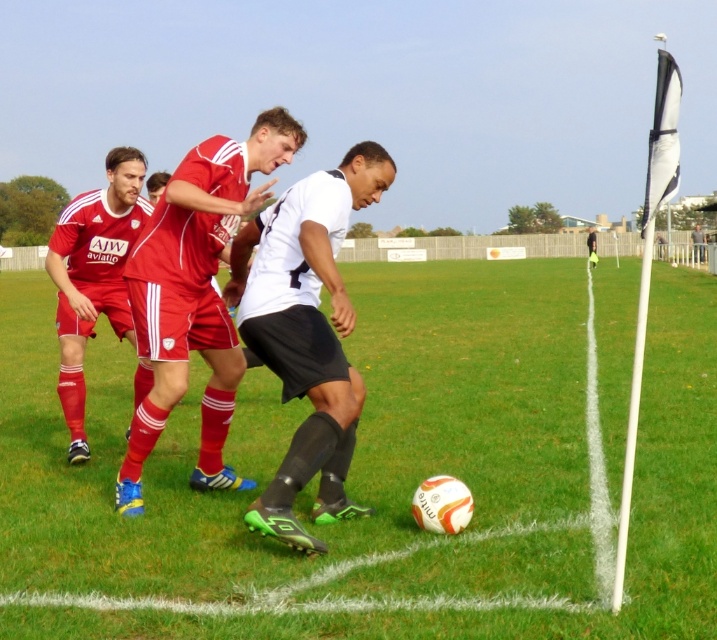
Is white matte soccer ball at center wider than matte red soccer jersey at left?

Correct, the width of white matte soccer ball at center exceeds that of matte red soccer jersey at left.

Where is `white matte soccer ball at center`? The width and height of the screenshot is (717, 640). white matte soccer ball at center is located at coordinates (294, 428).

Is point (551, 333) farther from viewer compared to point (110, 193)?

Yes.

At what (x,y) coordinates should I click in order to perform the action: click on white matte soccer ball at center. Please return your answer as a coordinate pair (x, y). Looking at the image, I should click on (294, 428).

Is the position of white matte soccer ball at center more distant than that of matte red shorts at center?

No, it is in front of matte red shorts at center.

From the picture: Is white matte soccer ball at center smaller than matte red shorts at center?

Incorrect, white matte soccer ball at center is not smaller in size than matte red shorts at center.

You are a GUI agent. You are given a task and a screenshot of the screen. Output one action in this format:
    pyautogui.click(x=<x>, y=<y>)
    Task: Click on the white matte soccer ball at center
    
    Given the screenshot: What is the action you would take?
    pyautogui.click(x=294, y=428)

This screenshot has width=717, height=640. I want to click on white matte soccer ball at center, so click(x=294, y=428).

Can you confirm if matte red shorts at center is positioned to the left of matte red soccer jersey at left?

In fact, matte red shorts at center is to the right of matte red soccer jersey at left.

Can you confirm if matte red shorts at center is wider than matte red soccer jersey at left?

No.

Where is `matte red shorts at center`? The width and height of the screenshot is (717, 640). matte red shorts at center is located at coordinates (194, 292).